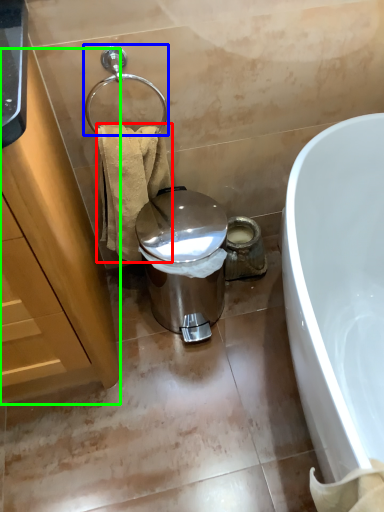
Question: Considering the real-world distances, which object is closest to towel/napkin (highlighted by a red box)? shower (highlighted by a blue box) or cabinetry (highlighted by a green box).

Choices:
 (A) shower
 (B) cabinetry

Answer: (A)